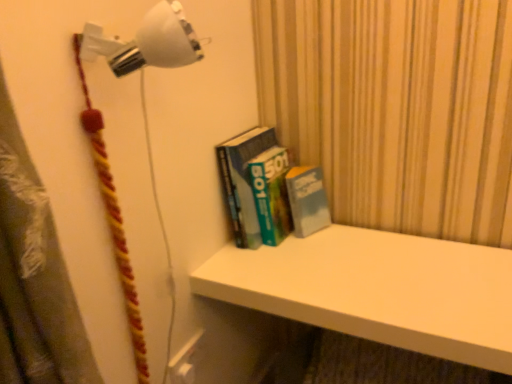
Question: From the image's perspective, is white plastic wall lamp at upper left, which is counted as the first lamp, starting from the top, above or below white matte shelf at upper center?

Choices:
 (A) below
 (B) above

Answer: (B)

Question: Considering the positions of white plastic wall lamp at upper left, which is counted as the first lamp, starting from the top, and white matte shelf at upper center in the image, is white plastic wall lamp at upper left, which is counted as the first lamp, starting from the top, bigger or smaller than white matte shelf at upper center?

Choices:
 (A) big
 (B) small

Answer: (B)

Question: Estimate the real-world distances between objects in this image. Which object is closer to the white plastic wall lamp at upper left, which is counted as the first lamp, starting from the top?

Choices:
 (A) white matte shelf at upper center
 (B) hardcover books at center
 (C) white plastic lamp at upper left, which is counted as the first lamp, starting from the bottom

Answer: (C)

Question: Which is farther from the white plastic lamp at upper left, which is counted as the first lamp, starting from the bottom?

Choices:
 (A) white plastic wall lamp at upper left, which is counted as the first lamp, starting from the top
 (B) hardcover books at center
 (C) white matte shelf at upper center

Answer: (C)